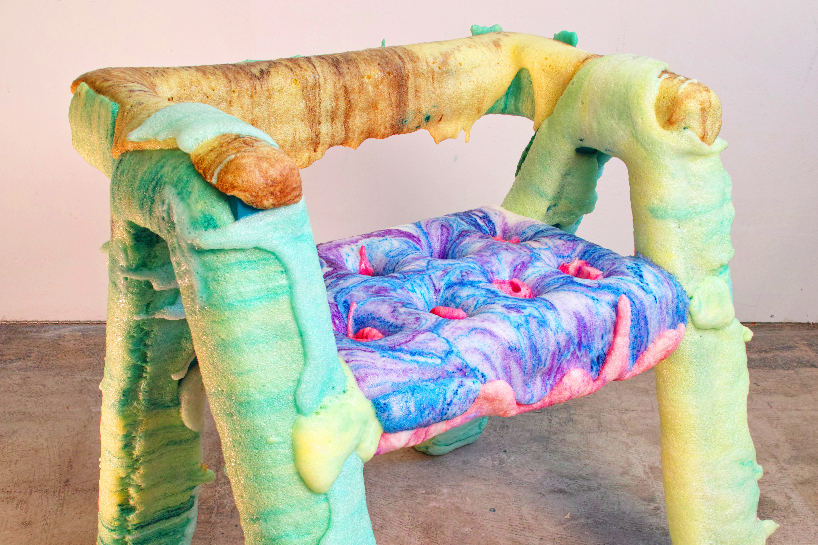
The image size is (818, 545). What are the coordinates of `floor` in the screenshot? It's located at (580, 520).